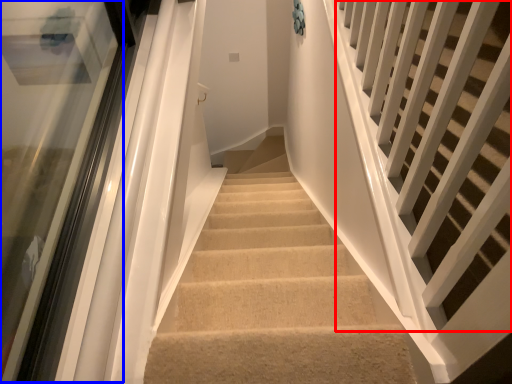
Question: Which object is further to the camera taking this photo, stairs (highlighted by a red box) or glass door (highlighted by a blue box)?

Choices:
 (A) stairs
 (B) glass door

Answer: (B)